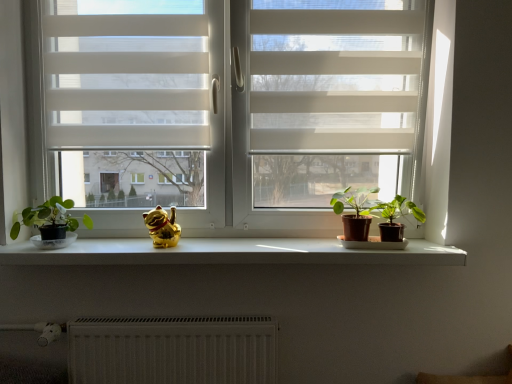
Locate an element on the screen. free spot below white matte window at center (from a real-world perspective) is located at coordinates (217, 241).